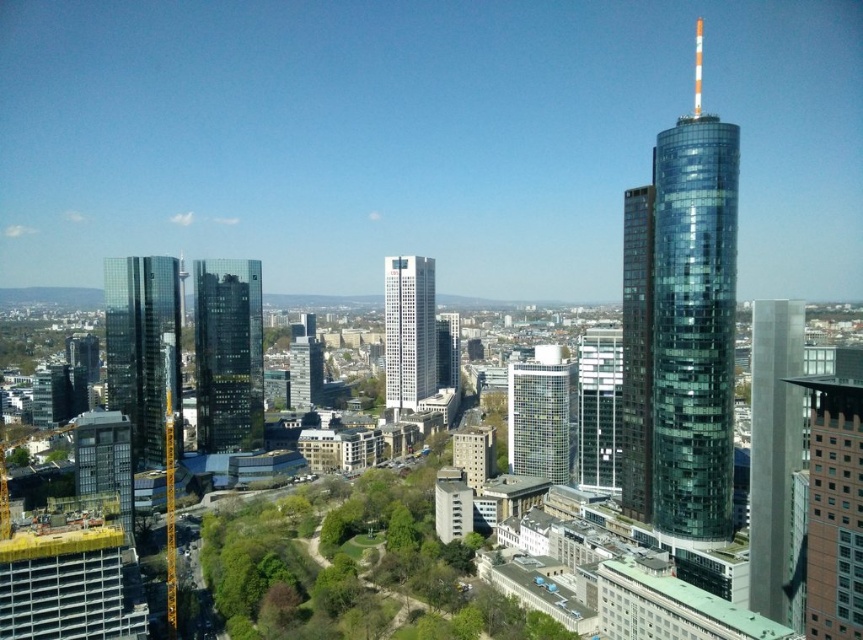
Question: Which of the following is the closest to the observer?

Choices:
 (A) glossy glass tower at upper right
 (B) silver glass skyscraper at center
 (C) glassy reflective skyscraper at center

Answer: (A)

Question: Does white glass skyscraper at center lie in front of glassy reflective skyscraper at center?

Choices:
 (A) no
 (B) yes

Answer: (A)

Question: Which point is closer to the camera?

Choices:
 (A) (255, 420)
 (B) (124, 308)
 (C) (750, 499)
 (D) (407, 307)

Answer: (C)

Question: Is glassy reflective skyscraper at right to the left of silver glass skyscraper at center from the viewer's perspective?

Choices:
 (A) yes
 (B) no

Answer: (B)

Question: Which of the following is the closest to the observer?

Choices:
 (A) glossy glass tower at upper right
 (B) white glass skyscraper at center
 (C) silver glass skyscraper at center

Answer: (A)

Question: Can you confirm if shiny glass skyscraper at center-left is positioned to the right of shiny glass skyscraper at right?

Choices:
 (A) yes
 (B) no

Answer: (B)